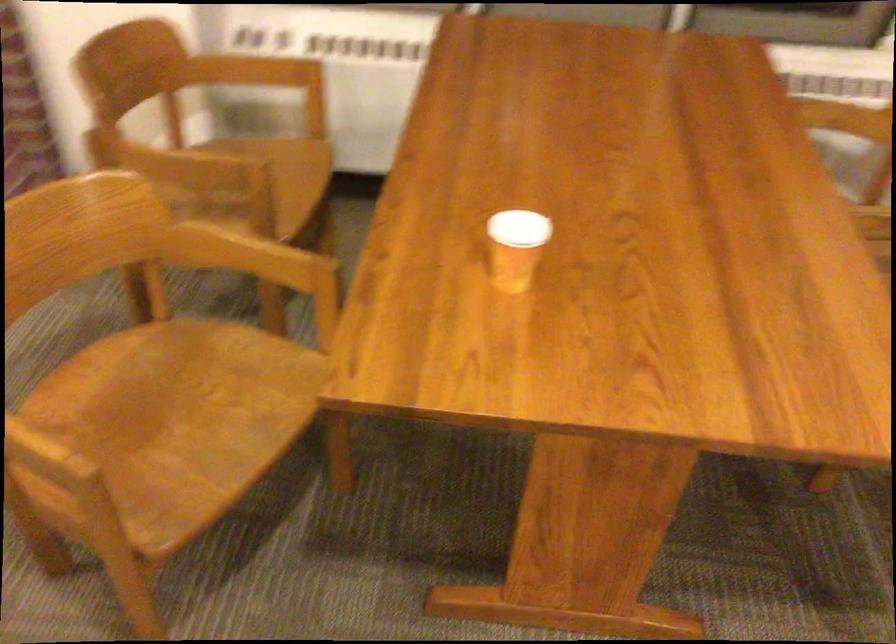
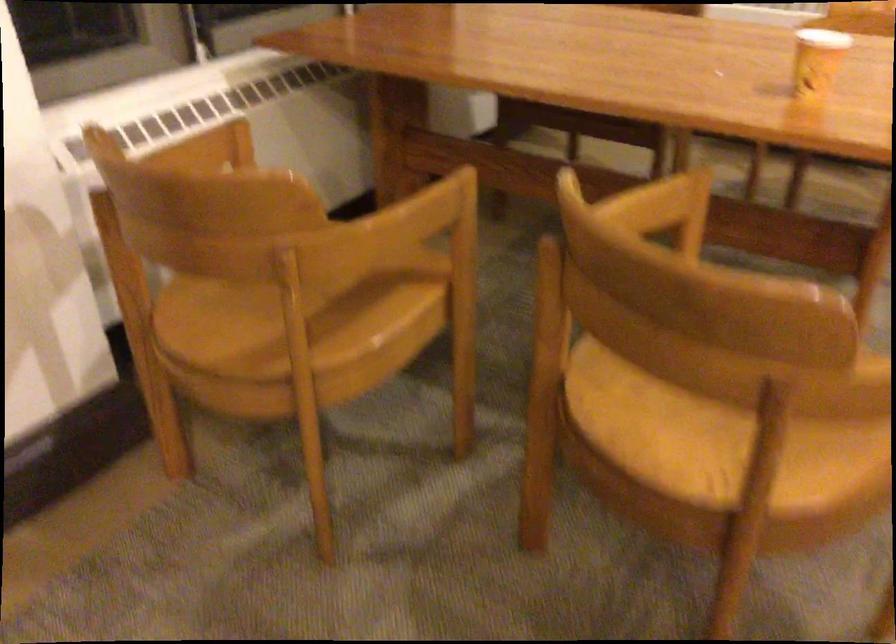
Where in the second image is the point corresponding to point (261, 259) from the first image?

(650, 205)